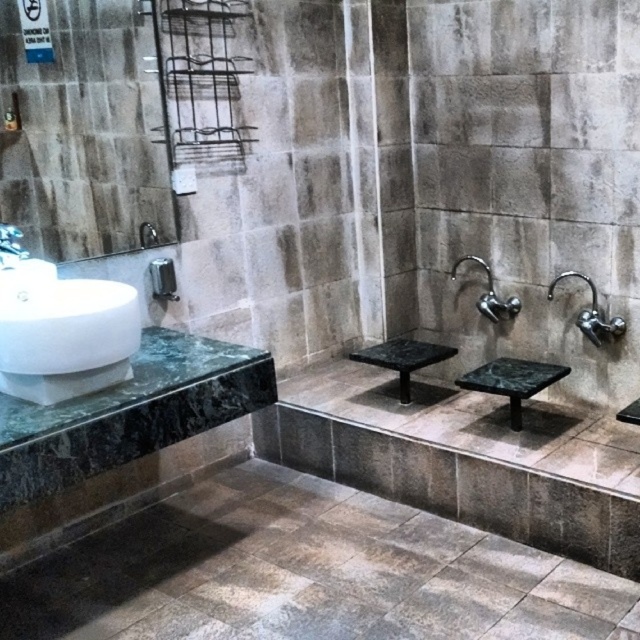
Question: Is white marble sink at left wider than black marble stool at center?

Choices:
 (A) yes
 (B) no

Answer: (B)

Question: Which point appears closest to the camera in this image?

Choices:
 (A) (221, 371)
 (B) (371, 362)
 (C) (588, 326)

Answer: (A)

Question: Among these objects, which one is nearest to the camera?

Choices:
 (A) white glossy faucet at upper left
 (B) satin nickel faucet at right
 (C) black marble stool at center

Answer: (A)

Question: Which of the following is the farthest from the observer?

Choices:
 (A) polished chrome faucet at upper center
 (B) white marble sink at left
 (C) green marble counter top at left

Answer: (A)

Question: In this image, where is green marble stool at center located relative to white glossy faucet at upper left?

Choices:
 (A) above
 (B) below

Answer: (B)

Question: Can you confirm if white marble sink at left is positioned below green marble counter top at left?

Choices:
 (A) no
 (B) yes

Answer: (A)